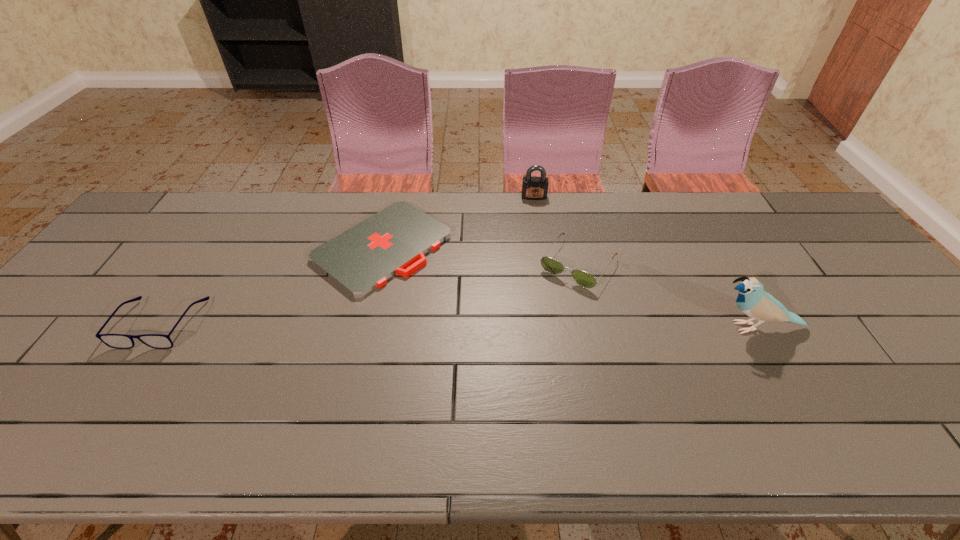
At what (x,y) coordinates should I click in order to perform the action: click on vacant area located 0.210m on handle side the first-aid kit. Please return your answer as a coordinate pair (x, y). The width and height of the screenshot is (960, 540). Looking at the image, I should click on (486, 318).

At what (x,y) coordinates should I click in order to perform the action: click on padlock situated at the far edge. Please return your answer as a coordinate pair (x, y). The image size is (960, 540). Looking at the image, I should click on (533, 188).

Locate an element on the screen. This screenshot has height=540, width=960. the first-aid kit that is at the far edge is located at coordinates (363, 258).

This screenshot has width=960, height=540. In the image, there is a desktop. Identify the location of blank space at the far edge. (339, 215).

In the image, there is a desktop. Find the location of `vacant space at the near edge`. vacant space at the near edge is located at coordinates (94, 389).

Locate an element on the screen. vacant region at the left edge is located at coordinates (49, 327).

This screenshot has width=960, height=540. Identify the location of vacant space at the far left corner of the desktop. (196, 195).

The width and height of the screenshot is (960, 540). Identify the location of vacant area that lies between the shortest object and the bird. (569, 287).

Where is `empty space between the padlock and the sunglasses`? empty space between the padlock and the sunglasses is located at coordinates (556, 230).

Locate an element on the screen. vacant space that's between the leftmost object and the rightmost object is located at coordinates (459, 326).